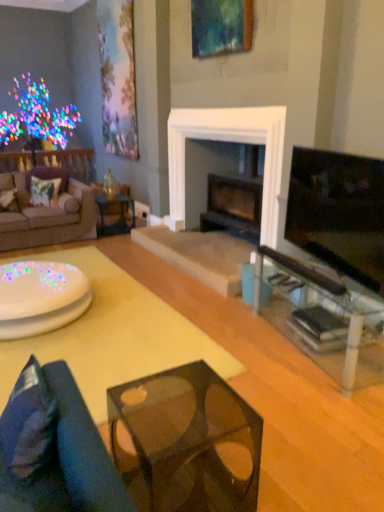
Question: Should I look upward or downward to see translucent glass coffee table at lower center?

Choices:
 (A) up
 (B) down

Answer: (B)

Question: From the image's perspective, is wooden picture frame at upper center, which ranks as the second picture frame in back-to-front order, beneath translucent glass coffee table at lower center?

Choices:
 (A) yes
 (B) no

Answer: (B)

Question: Is translucent glass coffee table at lower center located within wooden picture frame at upper center, which is the second picture frame from left to right?

Choices:
 (A) no
 (B) yes

Answer: (A)

Question: Can you confirm if wooden picture frame at upper center, the 1th picture frame positioned from the front, is positioned to the right of translucent glass coffee table at lower center?

Choices:
 (A) yes
 (B) no

Answer: (A)

Question: Is wooden picture frame at upper center, which is the second picture frame from left to right, shorter than translucent glass coffee table at lower center?

Choices:
 (A) no
 (B) yes

Answer: (A)

Question: Is wooden picture frame at upper center, the 1th picture frame positioned from the front, further to the viewer compared to translucent glass coffee table at lower center?

Choices:
 (A) no
 (B) yes

Answer: (B)

Question: Does wooden picture frame at upper center, which ranks as the second picture frame in back-to-front order, have a lesser width compared to translucent glass coffee table at lower center?

Choices:
 (A) no
 (B) yes

Answer: (B)

Question: Can you confirm if transparent glass table at right, marked as the 3th table in a left-to-right arrangement, is positioned to the right of matte floral painting at upper left, positioned as the 2th picture frame in right-to-left order?

Choices:
 (A) no
 (B) yes

Answer: (B)

Question: Would you consider transparent glass table at right, marked as the 3th table in a left-to-right arrangement, to be distant from matte floral painting at upper left, positioned as the 2th picture frame in right-to-left order?

Choices:
 (A) yes
 (B) no

Answer: (A)

Question: From the image's perspective, would you say transparent glass table at right, placed as the 1th table when sorted from right to left, is shown under matte floral painting at upper left, which is the second picture frame in front-to-back order?

Choices:
 (A) yes
 (B) no

Answer: (A)

Question: Is transparent glass table at right, placed as the 1th table when sorted from right to left, looking in the opposite direction of matte floral painting at upper left, acting as the 1th picture frame starting from the left?

Choices:
 (A) yes
 (B) no

Answer: (B)

Question: From a real-world perspective, is transparent glass table at right, placed as the 1th table when sorted from right to left, positioned under matte floral painting at upper left, acting as the 1th picture frame starting from the left, based on gravity?

Choices:
 (A) no
 (B) yes

Answer: (B)

Question: Considering the relative sizes of transparent glass table at right, marked as the 3th table in a left-to-right arrangement, and matte floral painting at upper left, which is the second picture frame in front-to-back order, in the image provided, is transparent glass table at right, marked as the 3th table in a left-to-right arrangement, bigger than matte floral painting at upper left, which is the second picture frame in front-to-back order,?

Choices:
 (A) no
 (B) yes

Answer: (B)

Question: Is brown fabric couch at left, which is the first studio couch in back-to-front order, bigger than dark blue fabric pillow at lower left, positioned as the 3th pillow in left-to-right order?

Choices:
 (A) no
 (B) yes

Answer: (B)